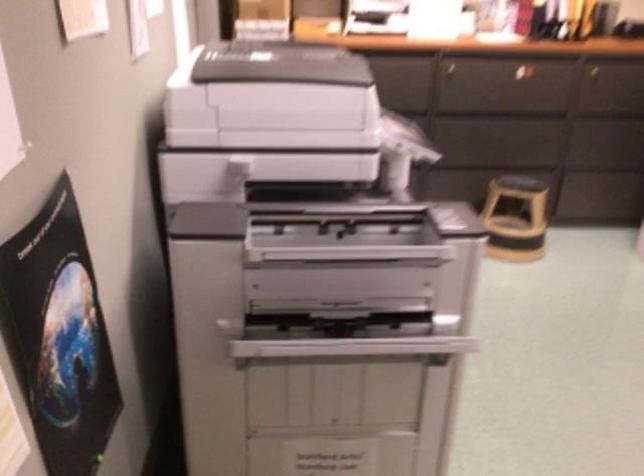
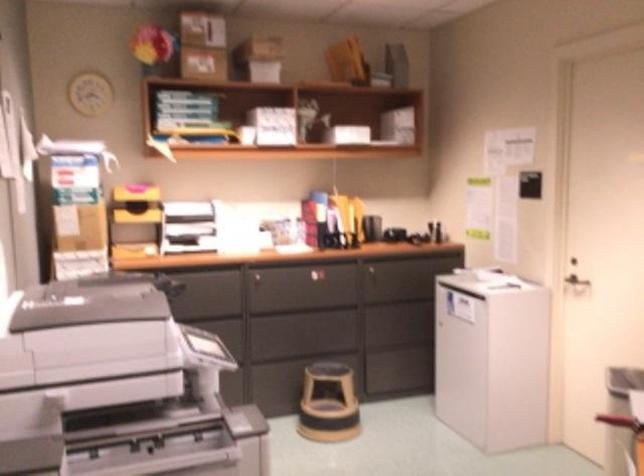
Locate, in the second image, the point that corresponds to (x=346, y=222) in the first image.

(133, 429)